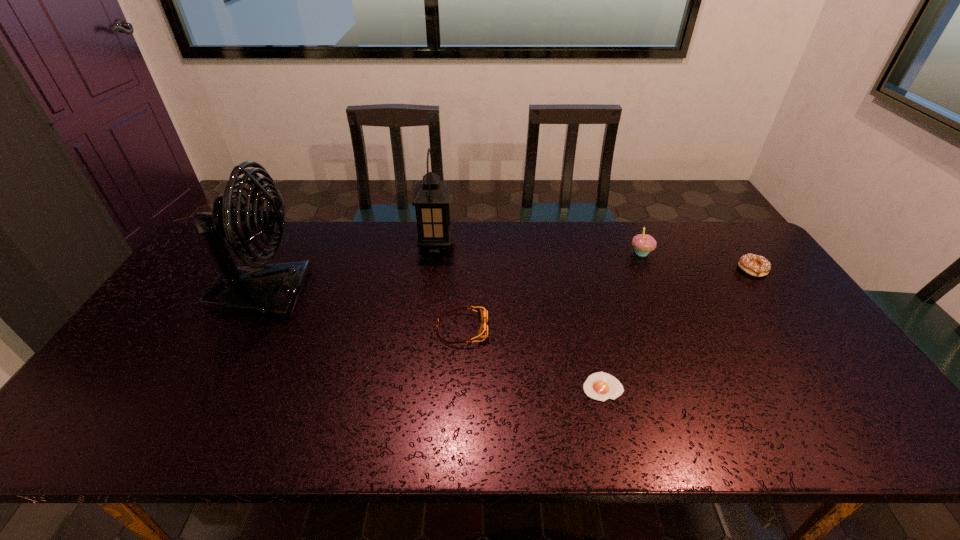
Find the location of a particular element. The width and height of the screenshot is (960, 540). free location located 0.200m on the left of the fifth shortest object is located at coordinates (359, 246).

Find the location of a particular element. free space located 0.340m on the left of the fourth shortest object is located at coordinates (527, 253).

You are a GUI agent. You are given a task and a screenshot of the screen. Output one action in this format:
    pyautogui.click(x=<x>, y=<y>)
    Task: Click on the free location located 0.160m with the lenses facing forward on the goggles
    
    Given the screenshot: What is the action you would take?
    546,329

This screenshot has width=960, height=540. What are the coordinates of `free spot located on the left of the doughnut` in the screenshot? It's located at (659, 269).

The image size is (960, 540). What are the coordinates of `vacant area situated 0.360m on the left of the shortest object` in the screenshot? It's located at (433, 387).

Find the location of a particular element. Image resolution: width=960 pixels, height=540 pixels. fan situated at the far edge is located at coordinates (259, 289).

Image resolution: width=960 pixels, height=540 pixels. What are the coordinates of `lantern located at the far edge` in the screenshot? It's located at (431, 196).

Locate an element on the screen. This screenshot has height=540, width=960. cupcake present at the far edge is located at coordinates (643, 244).

At what (x,y) coordinates should I click in order to perform the action: click on doughnut located in the far edge section of the desktop. Please return your answer as a coordinate pair (x, y). The image size is (960, 540). Looking at the image, I should click on (754, 265).

Locate an element on the screen. This screenshot has width=960, height=540. object that is positioned at the left edge is located at coordinates (259, 289).